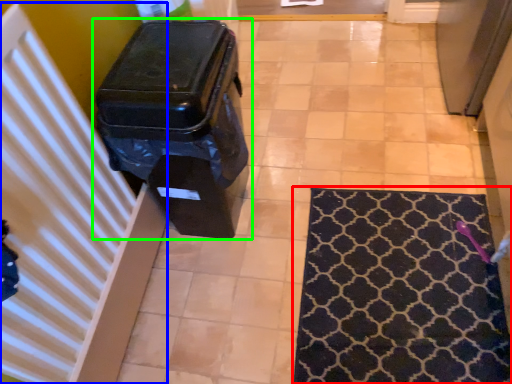
Question: Based on their relative distances, which object is farther from mat (highlighted by a red box)? Choose from radiator (highlighted by a blue box) and waste container (highlighted by a green box).

Choices:
 (A) radiator
 (B) waste container

Answer: (A)